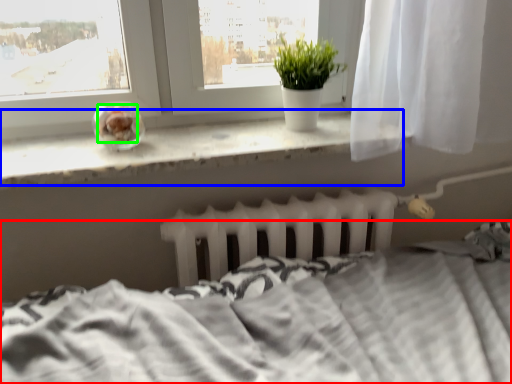
Question: Which is nearer to the bed (highlighted by a red box)? window sill (highlighted by a blue box) or food (highlighted by a green box).

Choices:
 (A) window sill
 (B) food

Answer: (A)